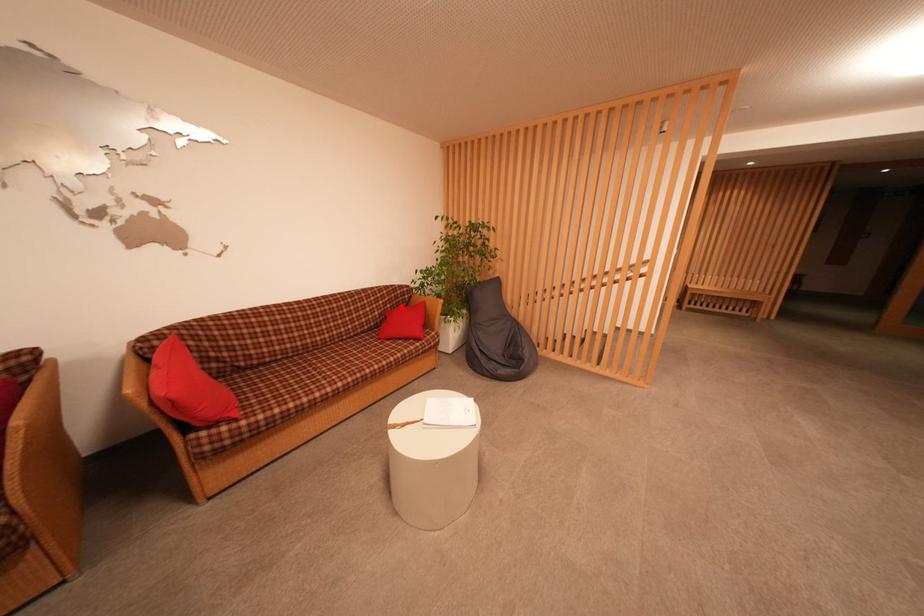
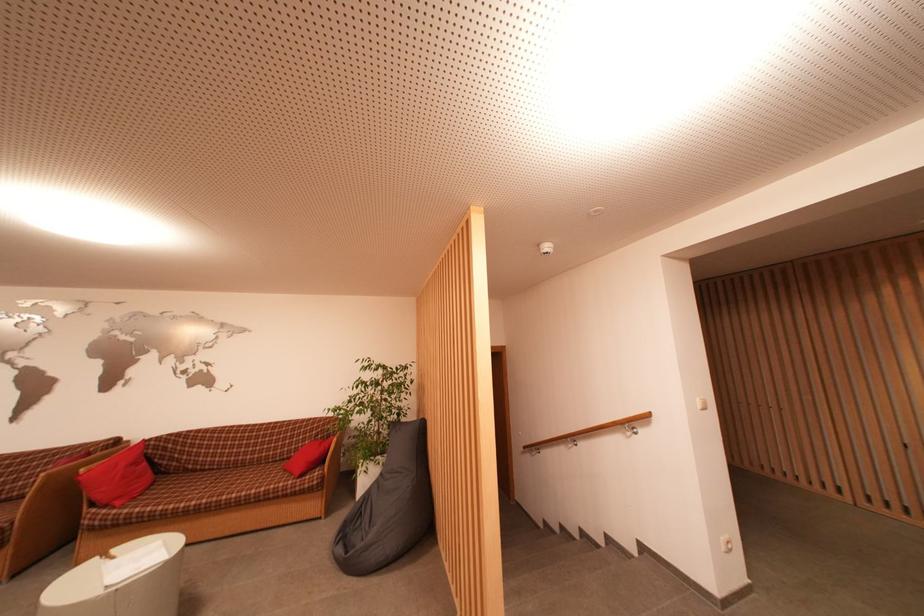
Where in the second image is the point corresponding to the highlighted location from the first image?

(333, 439)